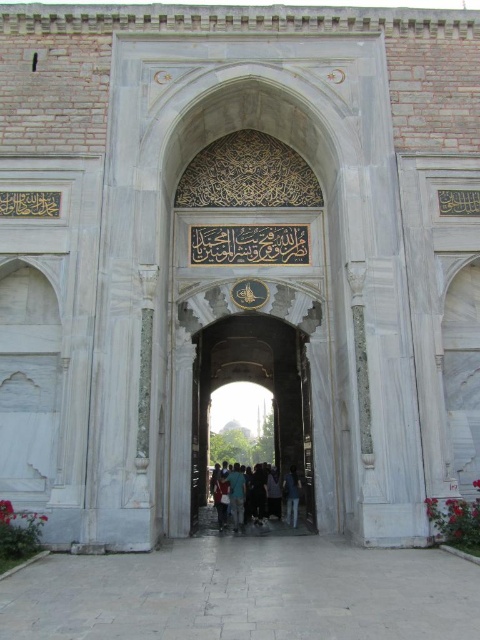
You are standing at the entrance of the historical building and see two pairs of jeans at the center. The dark blue jeans at center and the light blue jeans at center. You want to place a 12 feet long decorative banner between them. Is there enough space?

The dark blue jeans at center is 10.96 feet away from light blue jeans at center. Since the banner is 12 feet long, which is longer than the distance between them, there isn not enough space to place the banner between them.

You are a photographer standing at the entrance of the historical building. You want to take a photo that includes both the white marble archway at center and the dark blue jeans at center. Which object should you position closer to the camera to ensure both are in frame without cropping?

You should position the dark blue jeans at center closer to the camera because the white marble archway at center is wider than the dark blue jeans at center, so keeping the jeans closer helps balance the composition and keeps both in frame.